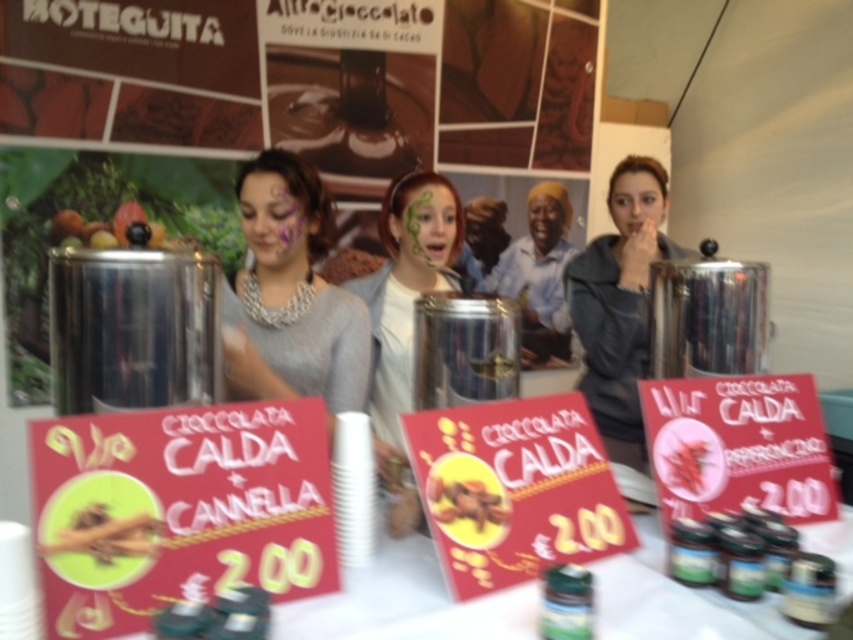
Can you confirm if smooth skin face at upper center is positioned above smooth skin face at center?

Incorrect, smooth skin face at upper center is not positioned above smooth skin face at center.

Is smooth skin face at upper center to the left of smooth skin face at center from the viewer's perspective?

No, smooth skin face at upper center is not to the left of smooth skin face at center.

Based on the photo, who is more forward, (647, 228) or (560, 224)?

Positioned in front is point (647, 228).

Image resolution: width=853 pixels, height=640 pixels. In order to click on smooth skin face at upper center in this screenshot , I will do `click(636, 204)`.

Is point (287, 244) positioned behind point (529, 216)?

No, it is not.

Can you confirm if matte purple face paint at center is taller than smooth skin face at center?

In fact, matte purple face paint at center may be shorter than smooth skin face at center.

Which is in front, point (242, 218) or point (561, 211)?

Point (242, 218) is in front.

Find the location of `matte purple face paint at center`. matte purple face paint at center is located at coordinates (274, 227).

Is matte gray jacket at center closer to the viewer compared to green matte face paint at center?

Yes, it is in front of green matte face paint at center.

Is matte gray jacket at center further to camera compared to green matte face paint at center?

No.

Between point (637, 280) and point (439, 246), which one is positioned in front?

Point (439, 246) is in front.

Locate an element on the screen. The image size is (853, 640). matte gray jacket at center is located at coordinates (619, 304).